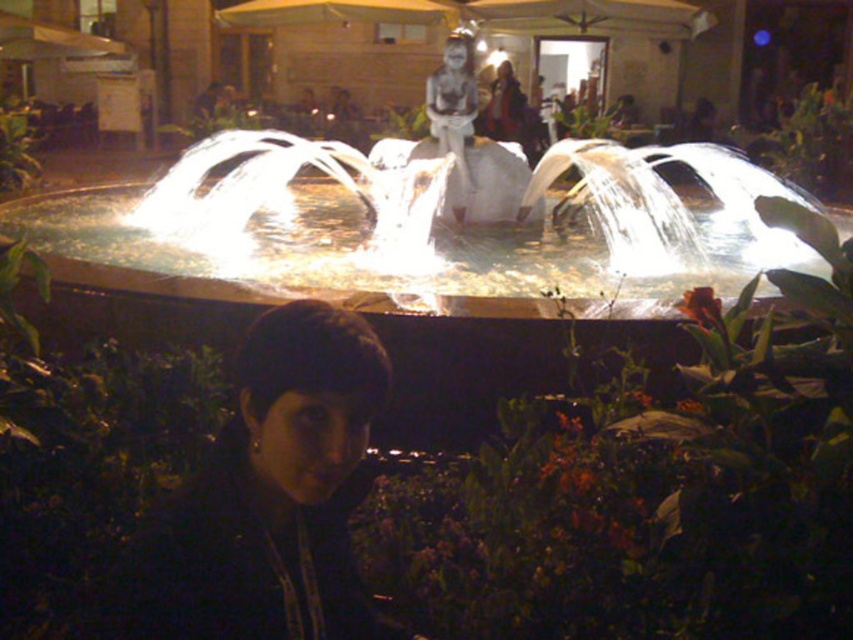
You are a photographer trying to capture the illuminated stone fountain at center and the dark matte hair at lower center in a single shot. Based on their sizes, which object should you focus on first to ensure both are in frame?

The illuminated stone fountain at center is larger than the dark matte hair at lower center, so you should focus on the illuminated stone fountain at center first to ensure both fit within the frame.

You are a photographer trying to capture the dark matte hair at lower center without the illuminated stone fountain at center blocking the view. Is this possible?

The dark matte hair at lower center is behind the illuminated stone fountain at center, so it would be blocked from view. You cannot capture the dark matte hair at lower center without the fountain obstructing it.